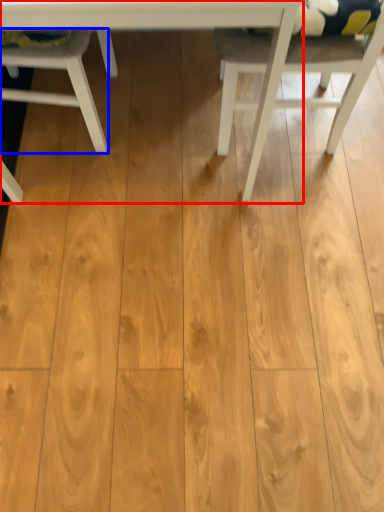
Question: Which object appears closest to the camera in this image, table (highlighted by a red box) or chair (highlighted by a blue box)?

Choices:
 (A) table
 (B) chair

Answer: (A)